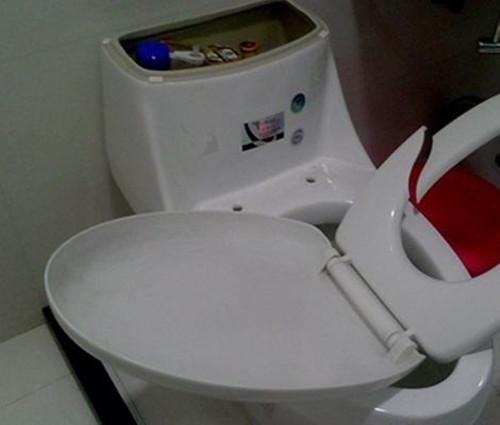
This screenshot has width=500, height=425. What are the coordinates of `white wall` in the screenshot? It's located at (57, 130).